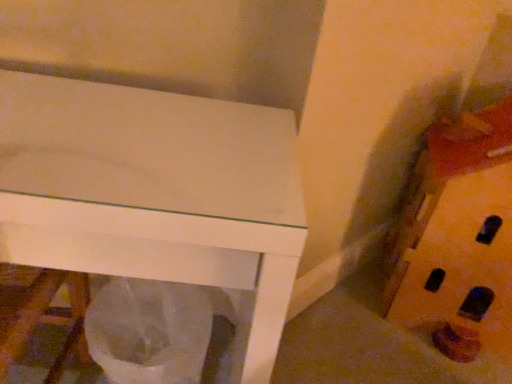
The height and width of the screenshot is (384, 512). Describe the element at coordinates (458, 237) in the screenshot. I see `wooden block at right` at that location.

Where is `wooden block at right`? wooden block at right is located at coordinates (458, 237).

The width and height of the screenshot is (512, 384). Describe the element at coordinates (151, 331) in the screenshot. I see `white plastic bag at lower center` at that location.

In order to face white plastic bag at lower center, should I rotate leftwards or rightwards?

To align with it, rotate left about 13.259°.

In order to click on white plastic bag at lower center in this screenshot , I will do `click(151, 331)`.

What is the approximate width of white plastic bag at lower center?

white plastic bag at lower center is 13.76 inches in width.

At what (x,y) coordinates should I click in order to perform the action: click on wooden block at right. Please return your answer as a coordinate pair (x, y). This screenshot has height=384, width=512. Looking at the image, I should click on (458, 237).

Is white plastic bag at lower center to the left or to the right of wooden block at right in the image?

From the image, it's evident that white plastic bag at lower center is to the left of wooden block at right.

Is the position of white plastic bag at lower center less distant than that of wooden block at right?

Yes, it is.

Which is in front, point (213, 381) or point (438, 194)?

The point (438, 194) is more forward.

From the image's perspective, which is below, white plastic bag at lower center or wooden block at right?

white plastic bag at lower center.

Consider the image. From a real-world perspective, which object rests below the other?

In real-world perspective, white plastic bag at lower center is lower.

Based on the photo, which object is wider, white plastic bag at lower center or wooden block at right?

Wider between the two is wooden block at right.

Who is taller, white plastic bag at lower center or wooden block at right?

Standing taller between the two is wooden block at right.

Considering the sizes of objects white plastic bag at lower center and wooden block at right in the image provided, who is bigger, white plastic bag at lower center or wooden block at right?

Bigger between the two is wooden block at right.

Can wooden block at right be found inside white plastic bag at lower center?

No, white plastic bag at lower center does not contain wooden block at right.

Is white plastic bag at lower center positioned far away from wooden block at right?

Actually, white plastic bag at lower center and wooden block at right are a little close together.

Could you tell me if white plastic bag at lower center is turned towards wooden block at right?

No, white plastic bag at lower center is not aimed at wooden block at right.

How many degrees apart are the facing directions of white plastic bag at lower center and wooden block at right?

11.4 degrees.

Locate an element on the screen. garbage that appears below the wooden block at right (from a real-world perspective) is located at coordinates (x=151, y=331).

Between wooden block at right and white plastic bag at lower center, which one appears on the left side from the viewer's perspective?

From the viewer's perspective, white plastic bag at lower center appears more on the left side.

Is the depth of wooden block at right greater than that of white plastic bag at lower center?

Yes, wooden block at right is further from the viewer.

Considering the points (479, 165) and (140, 359), which point is in front, point (479, 165) or point (140, 359)?

Positioned in front is point (479, 165).

From the image's perspective, which one is positioned lower, wooden block at right or white plastic bag at lower center?

white plastic bag at lower center.

In the scene shown: From a real-world perspective, which is physically above, wooden block at right or white plastic bag at lower center?

wooden block at right is physically above.

Considering the sizes of objects wooden block at right and white plastic bag at lower center in the image provided, who is wider, wooden block at right or white plastic bag at lower center?

With larger width is wooden block at right.

Considering the relative sizes of wooden block at right and white plastic bag at lower center in the image provided, is wooden block at right shorter than white plastic bag at lower center?

No.

Who is bigger, wooden block at right or white plastic bag at lower center?

wooden block at right.

Could white plastic bag at lower center be considered to be inside wooden block at right?

No, white plastic bag at lower center is not a part of wooden block at right.

Is wooden block at right touching white plastic bag at lower center?

They are not placed beside each other.

Is wooden block at right oriented towards white plastic bag at lower center?

No, wooden block at right is not aimed at white plastic bag at lower center.

Where is `toy lying above the white plastic bag at lower center (from the image's perspective)`? toy lying above the white plastic bag at lower center (from the image's perspective) is located at coordinates (458, 237).

Image resolution: width=512 pixels, height=384 pixels. Find the location of `toy above the white plastic bag at lower center (from the image's perspective)`. toy above the white plastic bag at lower center (from the image's perspective) is located at coordinates pyautogui.click(x=458, y=237).

Image resolution: width=512 pixels, height=384 pixels. I want to click on garbage in front of the wooden block at right, so click(151, 331).